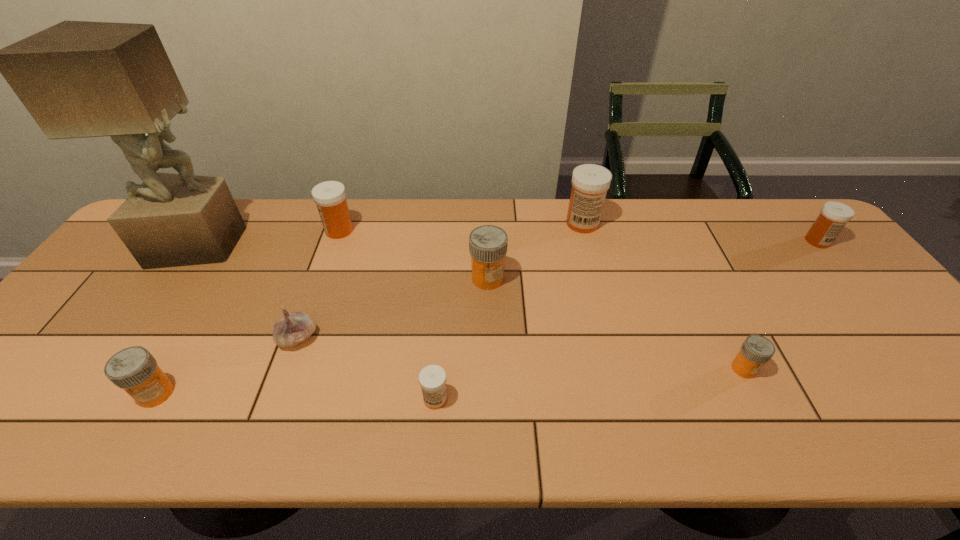
Where is `vacant region located 0.370m on the right of the third smallest white medicine`? The height and width of the screenshot is (540, 960). vacant region located 0.370m on the right of the third smallest white medicine is located at coordinates (473, 230).

The width and height of the screenshot is (960, 540). What are the coordinates of `vacant region located on the label side of the fourth medicine from left to right` in the screenshot? It's located at (490, 399).

This screenshot has width=960, height=540. I want to click on vacant point located on the back of the third biggest white medicine, so click(796, 215).

Locate an element on the screen. free location located 0.070m on the label side of the second biggest orange medicine is located at coordinates (129, 441).

Where is `free space located on the back of the white garlic`? The width and height of the screenshot is (960, 540). free space located on the back of the white garlic is located at coordinates (323, 268).

You are a GUI agent. You are given a task and a screenshot of the screen. Output one action in this format:
    pyautogui.click(x=<x>, y=<y>)
    Task: Click on the vacant area located 0.220m on the right of the smallest white medicine
    The image size is (960, 540).
    Given the screenshot: What is the action you would take?
    pyautogui.click(x=549, y=399)

At what (x,y) coordinates should I click in order to perform the action: click on sculpture at the far edge. Please return your answer as a coordinate pair (x, y). Looking at the image, I should click on (77, 79).

The image size is (960, 540). In order to click on object that is at the left edge in this screenshot , I will do `click(77, 79)`.

Find the location of a particular element. This screenshot has height=540, width=960. object situated at the right edge is located at coordinates (834, 215).

Locate an element on the screen. object situated at the far left corner is located at coordinates (77, 79).